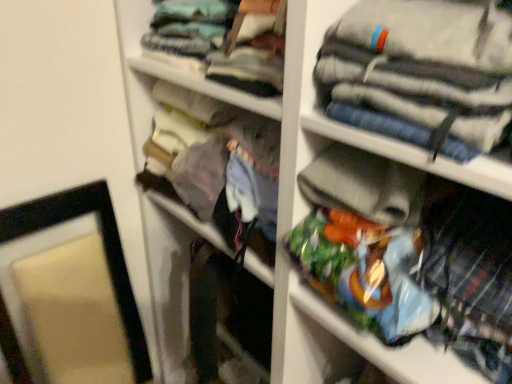
Question: Is matte fabric purse at center at the left side of light blue fabric at upper center, which is the 1th clothing in top-to-bottom order?

Choices:
 (A) yes
 (B) no

Answer: (A)

Question: Is matte fabric purse at center positioned before light blue fabric at upper center, which is the 1th clothing in top-to-bottom order?

Choices:
 (A) yes
 (B) no

Answer: (B)

Question: Can you confirm if matte fabric purse at center is shorter than light blue fabric at upper center, which is the 1th clothing in top-to-bottom order?

Choices:
 (A) no
 (B) yes

Answer: (A)

Question: Can we say matte fabric purse at center lies outside light blue fabric at upper center, which is the 3th clothing in bottom-to-top order?

Choices:
 (A) yes
 (B) no

Answer: (A)

Question: Considering the relative sizes of matte fabric purse at center and light blue fabric at upper center, which is the 3th clothing in bottom-to-top order, in the image provided, is matte fabric purse at center thinner than light blue fabric at upper center, which is the 3th clothing in bottom-to-top order,?

Choices:
 (A) yes
 (B) no

Answer: (B)

Question: From the image's perspective, does matte fabric purse at center appear lower than light blue fabric at upper center, which is the 3th clothing in bottom-to-top order?

Choices:
 (A) yes
 (B) no

Answer: (A)

Question: From the image's perspective, is light blue fabric at upper center, which is the 1th clothing in top-to-bottom order, below striped cotton pants at upper right, acting as the second clothing starting from the bottom?

Choices:
 (A) no
 (B) yes

Answer: (A)

Question: Does light blue fabric at upper center, which is the 3th clothing in bottom-to-top order, have a lesser height compared to striped cotton pants at upper right, the second clothing when ordered from top to bottom?

Choices:
 (A) yes
 (B) no

Answer: (A)

Question: Is striped cotton pants at upper right, acting as the second clothing starting from the bottom, at the back of light blue fabric at upper center, which is the 1th clothing in top-to-bottom order?

Choices:
 (A) no
 (B) yes

Answer: (A)

Question: Does light blue fabric at upper center, which is the 1th clothing in top-to-bottom order, have a greater width compared to striped cotton pants at upper right, acting as the second clothing starting from the bottom?

Choices:
 (A) yes
 (B) no

Answer: (A)

Question: Considering the relative sizes of light blue fabric at upper center, which is the 3th clothing in bottom-to-top order, and striped cotton pants at upper right, the second clothing when ordered from top to bottom, in the image provided, is light blue fabric at upper center, which is the 3th clothing in bottom-to-top order, bigger than striped cotton pants at upper right, the second clothing when ordered from top to bottom,?

Choices:
 (A) yes
 (B) no

Answer: (A)

Question: Is light blue fabric at upper center, which is the 3th clothing in bottom-to-top order, positioned beyond the bounds of striped cotton pants at upper right, the second clothing when ordered from top to bottom?

Choices:
 (A) yes
 (B) no

Answer: (A)

Question: Does plaid fabric shirt at lower right, which is the 3th clothing in top-to-bottom order, appear on the right side of light blue fabric at upper center, which is the 1th clothing in top-to-bottom order?

Choices:
 (A) no
 (B) yes

Answer: (B)